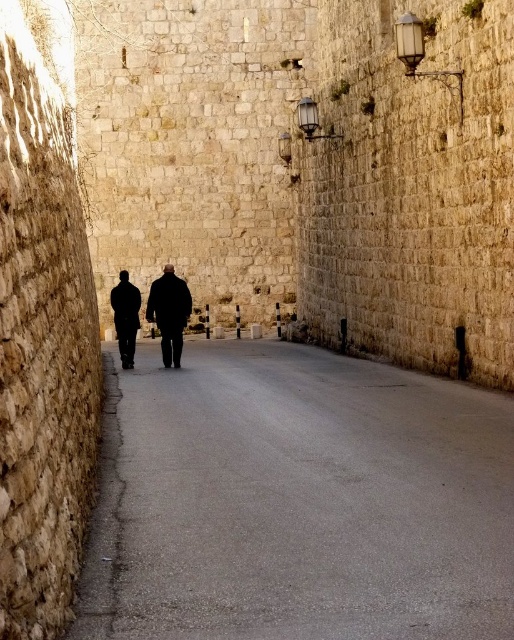
You are standing at the entrance of the narrow cobblestone street between the tall stone walls. You notice two points marked on the ground. The first point is at coordinate point (x=432, y=403) and the second is at point (x=122, y=272). Which point is closer to you as you face the street?

Point (x=432, y=403) is closer to the camera than point (x=122, y=272), so the first point is closer to you.

You are a pedestrian walking along the narrow cobblestone street. You notice the gray asphalt road at center and the black matte clothing at center. Which object is closer to you as you walk forward?

The gray asphalt road at center is closer to you because it is in front of the black matte clothing at center.

You are a delivery person carrying a large package and need to walk down the narrow cobblestone street. You notice the gray asphalt road at center and the dark matte coat at center. Which object is shorter and might pose a lower risk of hitting your head?

The gray asphalt road at center is not as tall as the dark matte coat at center, so the gray asphalt road at center is shorter and poses a lower risk of hitting your head.